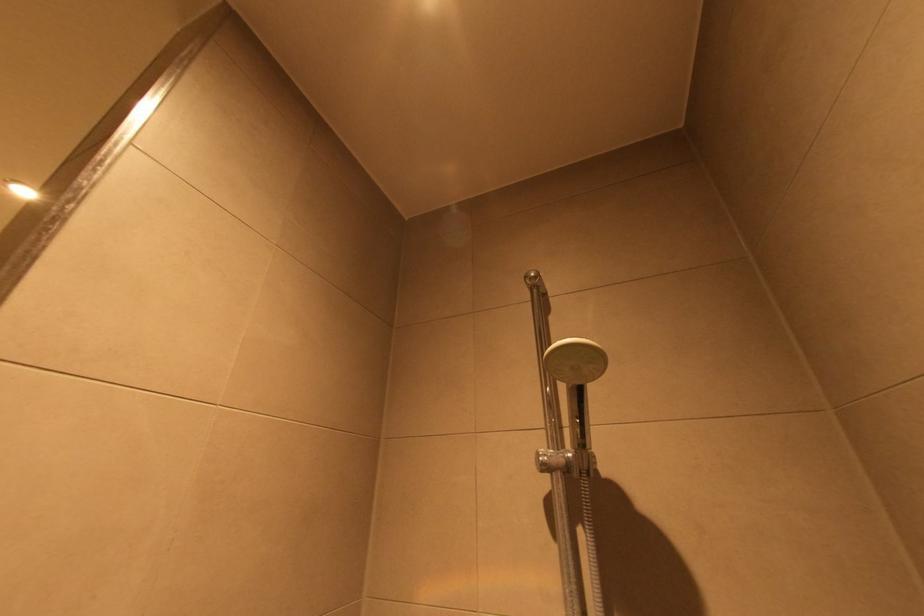
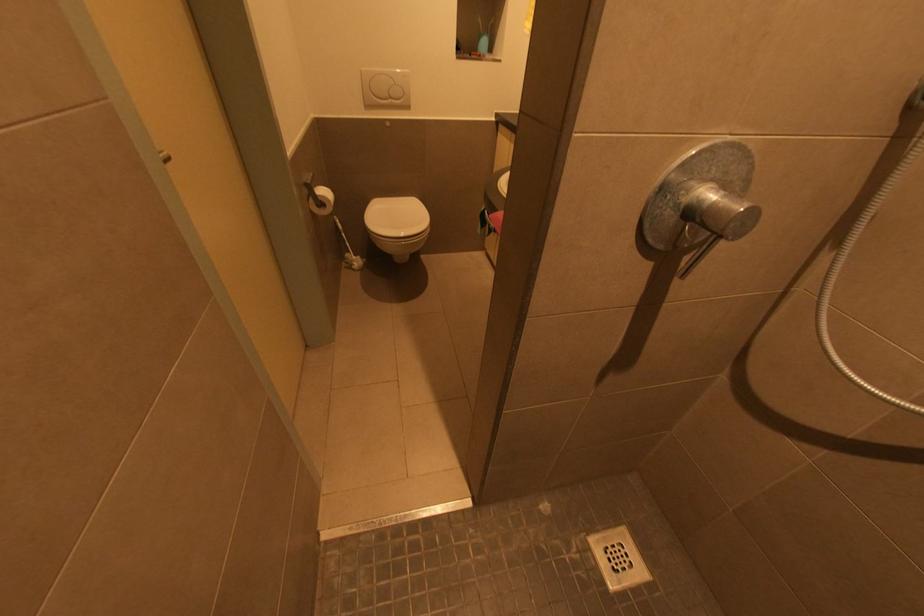
How did the camera likely rotate?

The camera rotated toward left-down.